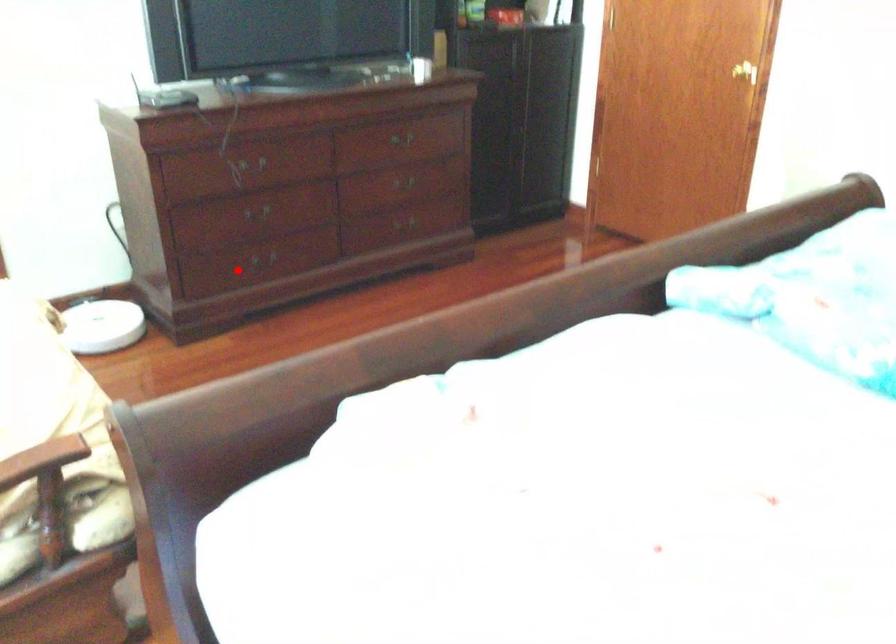
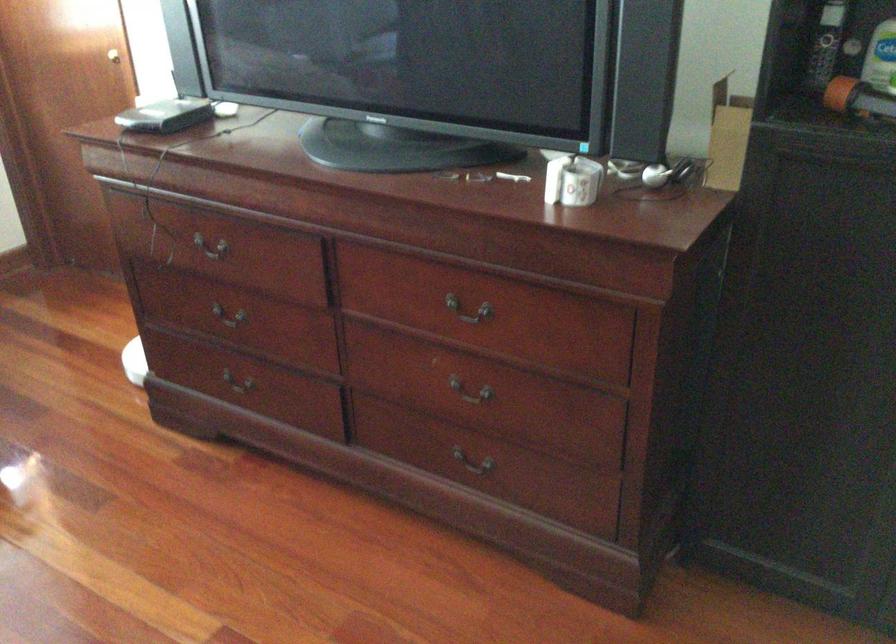
Locate, in the second image, the point that corresponds to the highlighted location in the first image.

(236, 391)